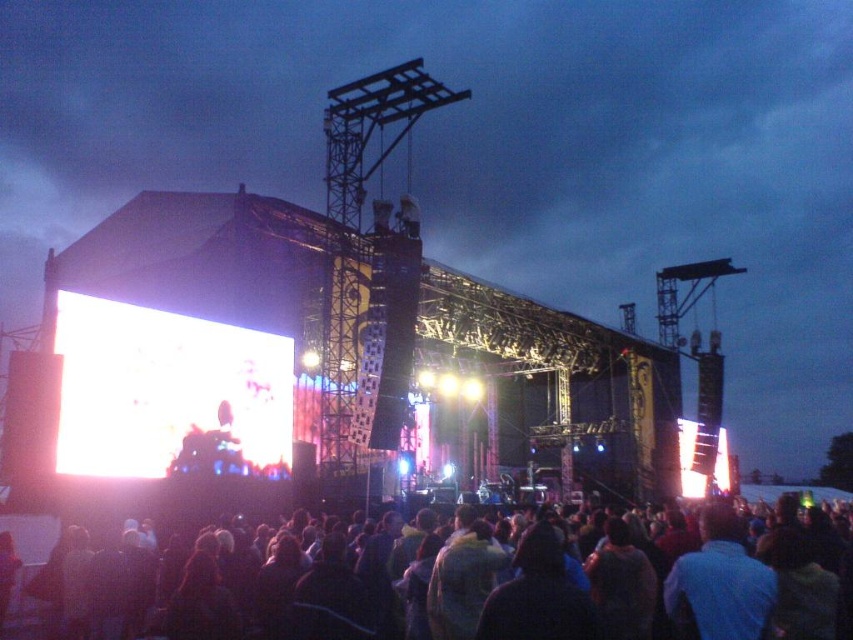
The image size is (853, 640). I want to click on dark fabric crowd at lower center, so click(621, 582).

Does point (798, 529) lie behind point (196, 365)?

Yes, it is behind point (196, 365).

At what (x,y) coordinates should I click in order to perform the action: click on dark fabric crowd at lower center. Please return your answer as a coordinate pair (x, y). This screenshot has width=853, height=640. Looking at the image, I should click on (621, 582).

Locate an element on the screen. The width and height of the screenshot is (853, 640). dark fabric crowd at lower center is located at coordinates (621, 582).